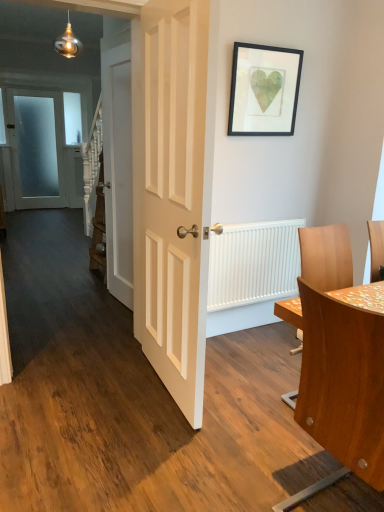
What are the coordinates of `vacant region in front of white glossy door at center, the first door when ordered from front to back` in the screenshot? It's located at (159, 446).